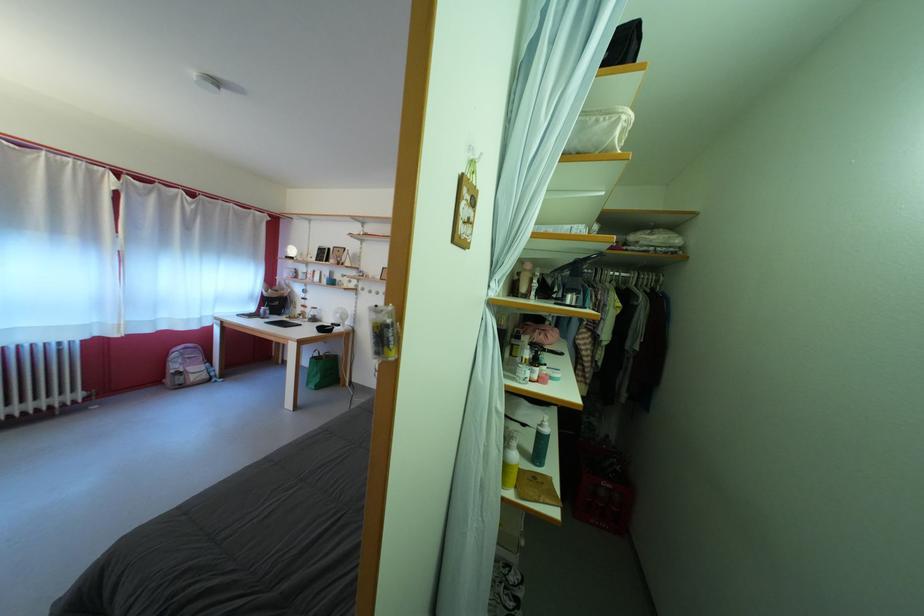
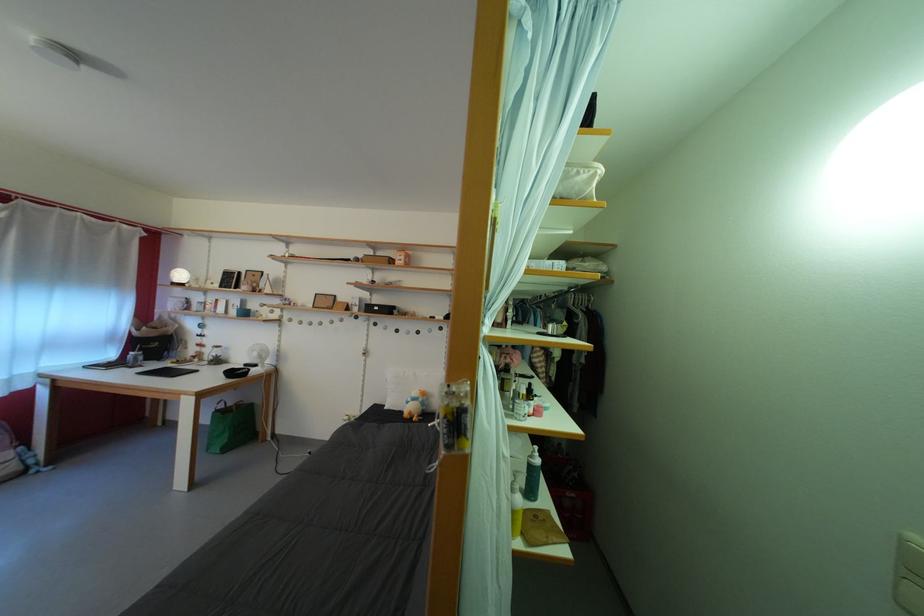
Question: The images are taken continuously from a first-person perspective. In which direction is your viewpoint rotating?

Choices:
 (A) Left
 (B) Right
 (C) Up
 (D) Down

Answer: (B)